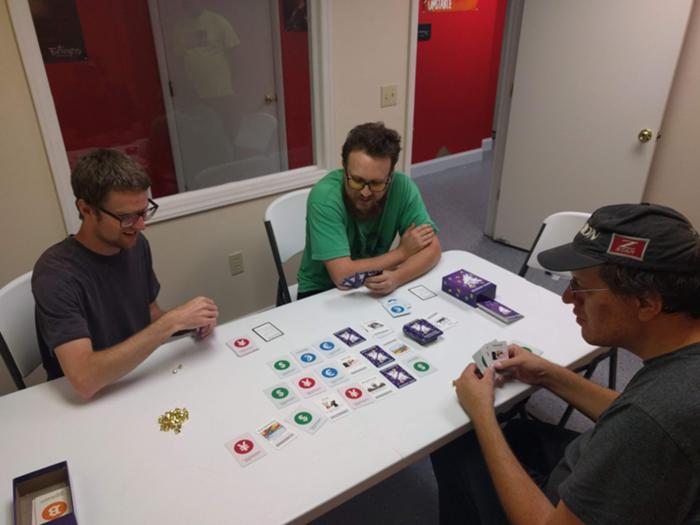
Locate an element on the screen. light switch is located at coordinates (386, 93).